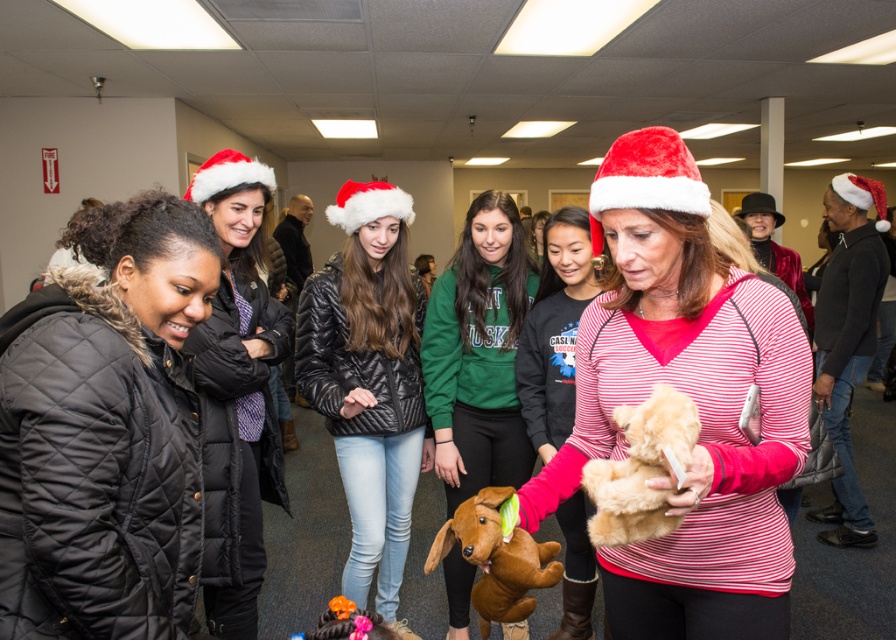
You are at a holiday party and see the velvet red santa hat at center and the matte black jacket at left. Which one is positioned more to the right side?

The velvet red santa hat at center is positioned more to the right side than the matte black jacket at left.

You are standing in the center of the room and need to locate the green fleece sweatshirt at center. According to the coordinates provided, in which direction should you move to find it?

The green fleece sweatshirt at center is located at coordinates point (478, 353). Since you are already at the center, you don not need to move in any direction to find it.

You are organizing a charity event and need to place a green fleece sweatshirt at center and a brown plush dog at center on a shelf. The shelf can only hold items that are no more than 1 meter wide. Can both items fit side by side on the shelf?

The green fleece sweatshirt at center might be wider than brown plush dog at center, so it is uncertain if both can fit side by side on the shelf without exceeding the 1 meter width limit. Measure both items to confirm.